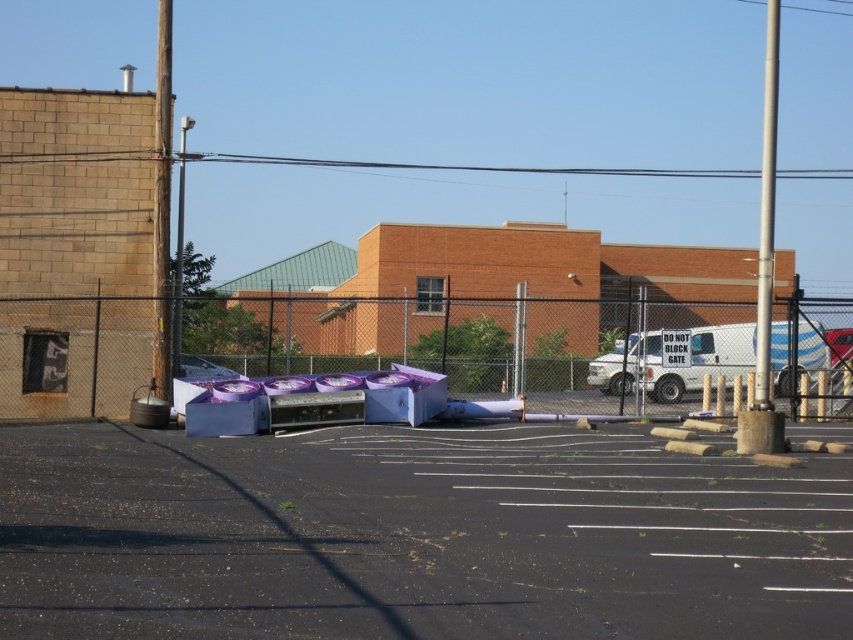
Can you confirm if black asphalt parking lot at center is positioned to the left of metallic chain-link fence at center?

Indeed, black asphalt parking lot at center is positioned on the left side of metallic chain-link fence at center.

Describe the element at coordinates (415, 536) in the screenshot. This screenshot has height=640, width=853. I see `black asphalt parking lot at center` at that location.

Identify the location of black asphalt parking lot at center. (415, 536).

Between point (315, 621) and point (590, 372), which one is positioned in front?

Point (315, 621)

Which is below, black asphalt parking lot at center or white van at center?

black asphalt parking lot at center is below.

Which is in front, point (689, 476) or point (775, 368)?

Point (689, 476) is more forward.

Image resolution: width=853 pixels, height=640 pixels. I want to click on black asphalt parking lot at center, so click(x=415, y=536).

Does metallic chain-link fence at center have a lesser width compared to white van at center?

No, metallic chain-link fence at center is not thinner than white van at center.

Between metallic chain-link fence at center and white van at center, which one has more height?

Standing taller between the two is metallic chain-link fence at center.

Who is more distant from viewer, (x=248, y=308) or (x=643, y=381)?

Positioned behind is point (x=643, y=381).

The width and height of the screenshot is (853, 640). In order to click on metallic chain-link fence at center in this screenshot , I will do `click(461, 337)`.